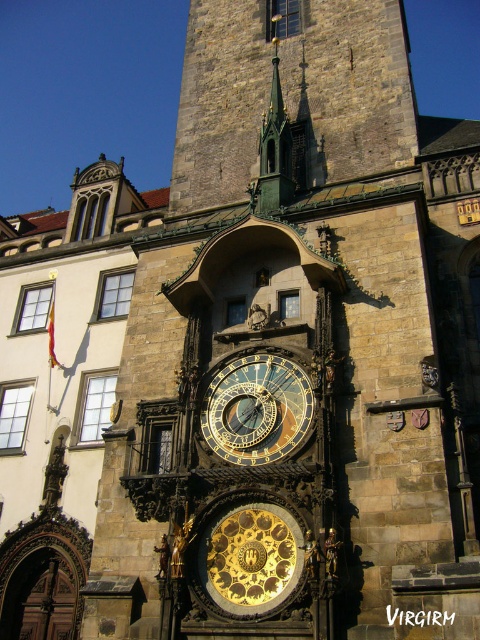
You are an architect examining the Old Town Hall Tower in Prague. You notice the gold metallic clock at center and the green metallic spire at upper center. Which object is wider?

The gold metallic clock at center is wider than the green metallic spire at upper center, as its width surpasses the spire.

You are an architect examining the Old Town Hall Tower in Prague. You notice two clocks on the tower wall. One is labeled as the gold metallic clock at center and the other as the gold plated clock at center. Which of these two clocks is taller?

The gold metallic clock at center is much taller than the gold plated clock at center.

You are an art conservator examining the Old Town Hall Tower in Prague. You notice two clocks on the tower wall, the gold metallic clock at center and the gold plated clock at center. Which one appears closer to your viewpoint?

The gold metallic clock at center appears closer to the viewer than the gold plated clock at center.